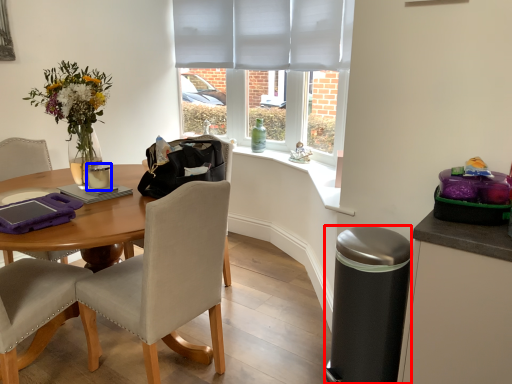
Question: Which of the following is the closest to the observer, trash bin/can (highlighted by a red box) or coffee cup (highlighted by a blue box)?

Choices:
 (A) trash bin/can
 (B) coffee cup

Answer: (A)